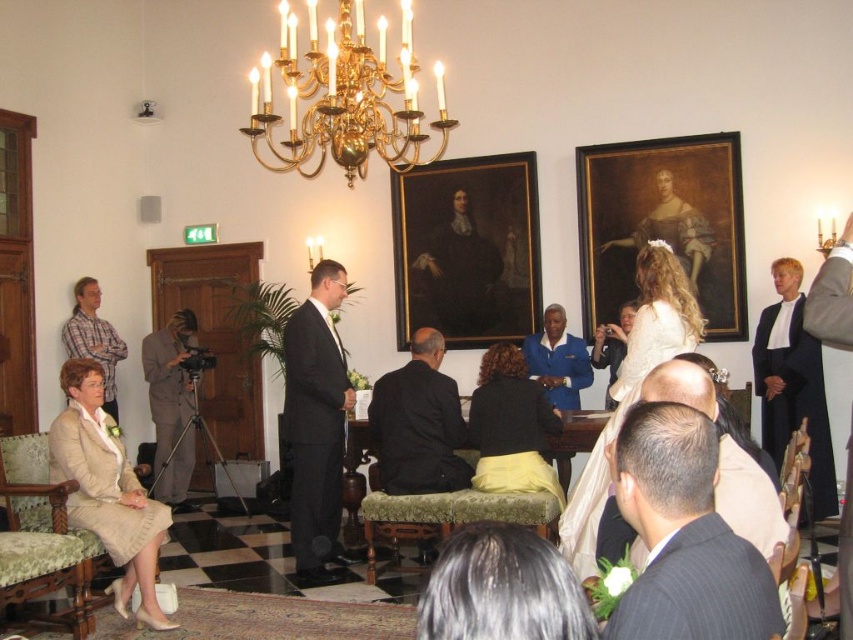
Question: Is beige fabric suit at lower left to the left of brown fabric camera at left from the viewer's perspective?

Choices:
 (A) yes
 (B) no

Answer: (B)

Question: Can you confirm if oil painting portrait at center is smaller than brown fabric camera at left?

Choices:
 (A) no
 (B) yes

Answer: (A)

Question: Can you confirm if oil painting portrait at center is positioned above plaid shirt at left?

Choices:
 (A) yes
 (B) no

Answer: (A)

Question: Which point appears farthest from the camera in this image?

Choices:
 (A) (386, 422)
 (B) (787, 436)
 (C) (322, 288)
 (D) (390, 156)

Answer: (D)

Question: Considering the real-world distances, which object is farthest from the black pinstripe suit at center?

Choices:
 (A) dark gray suit at right
 (B) beige fabric chair at lower left
 (C) black wool suit at right

Answer: (C)

Question: Among these objects, which one is farthest from the camera?

Choices:
 (A) beige fabric suit at lower left
 (B) black wool suit at right
 (C) dark gray suit at right
 (D) matte black suit at center

Answer: (B)